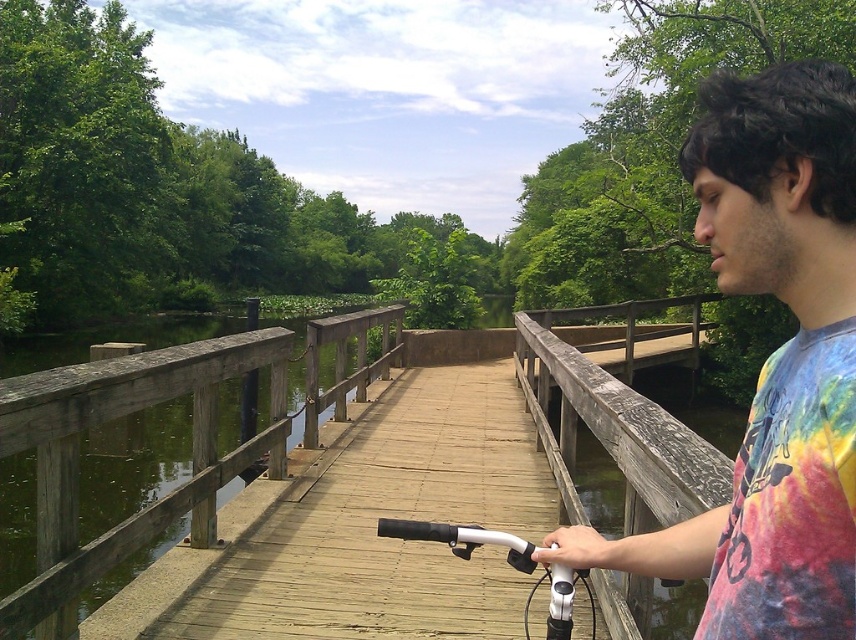
Question: Which object appears closest to the camera in this image?

Choices:
 (A) weathered wood rail at center
 (B) green wood waterway at center
 (C) white matte bicycle handlebars at center

Answer: (C)

Question: Does green wood waterway at center lie behind weathered wood rail at center?

Choices:
 (A) yes
 (B) no

Answer: (A)

Question: Which of the following is the closest to the observer?

Choices:
 (A) (803, 400)
 (B) (675, 432)
 (C) (52, 468)
 (D) (528, 545)

Answer: (A)

Question: Is the position of weathered wood rail at center less distant than that of white matte bicycle handlebars at center?

Choices:
 (A) yes
 (B) no

Answer: (B)

Question: Considering the relative positions of tie-dye fabric shirt at center and green wood waterway at center in the image provided, where is tie-dye fabric shirt at center located with respect to green wood waterway at center?

Choices:
 (A) right
 (B) left

Answer: (A)

Question: Which point is closer to the camera taking this photo?

Choices:
 (A) (403, 529)
 (B) (400, 348)
 (C) (646, 547)
 (D) (638, 532)

Answer: (C)